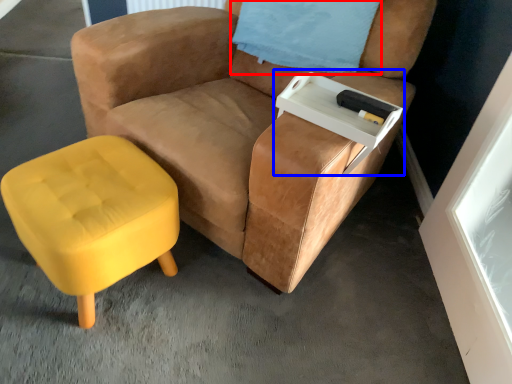
Question: Which of the following is the closest to the observer, pillow (highlighted by a red box) or side table (highlighted by a blue box)?

Choices:
 (A) pillow
 (B) side table

Answer: (B)